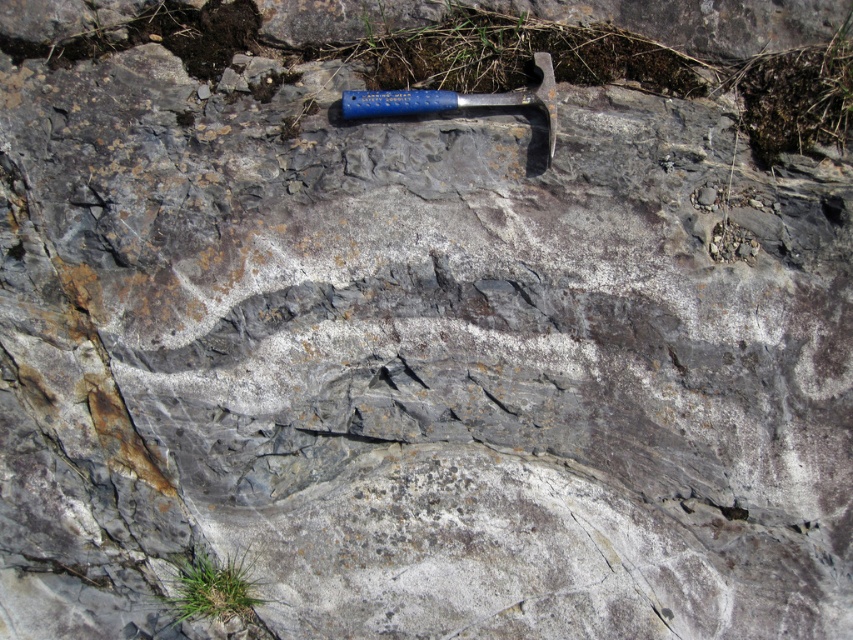
Question: Observing the image, what is the correct spatial positioning of blue plastic hammer at center in reference to blue metallic hammer at upper center?

Choices:
 (A) right
 (B) left

Answer: (A)

Question: Among these objects, which one is nearest to the camera?

Choices:
 (A) blue plastic hammer at center
 (B) blue metallic hammer at upper center

Answer: (A)

Question: Is blue plastic hammer at center above blue metallic hammer at upper center?

Choices:
 (A) no
 (B) yes

Answer: (A)

Question: Is blue plastic hammer at center bigger than blue metallic hammer at upper center?

Choices:
 (A) no
 (B) yes

Answer: (B)

Question: Which point is farther from the camera taking this photo?

Choices:
 (A) (364, 102)
 (B) (534, 99)

Answer: (B)